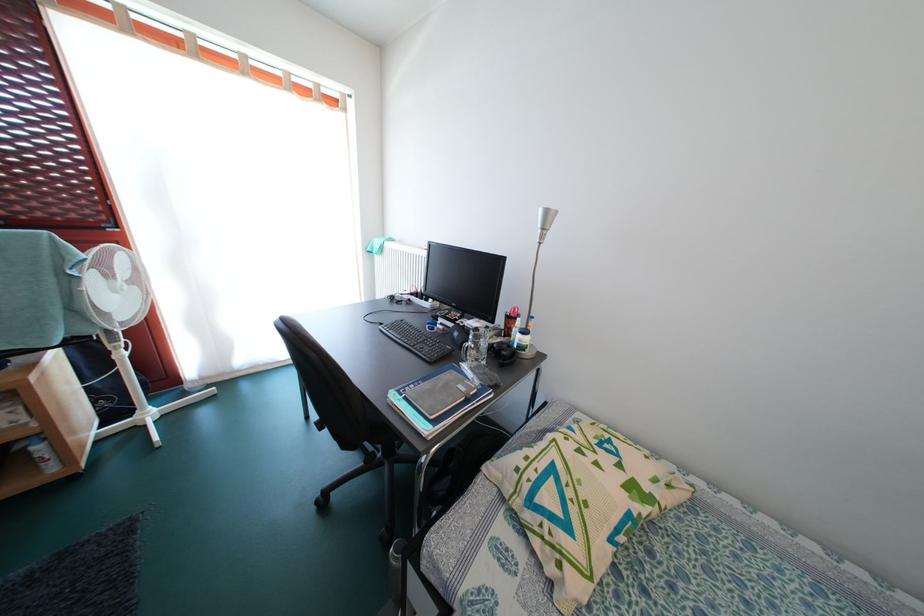
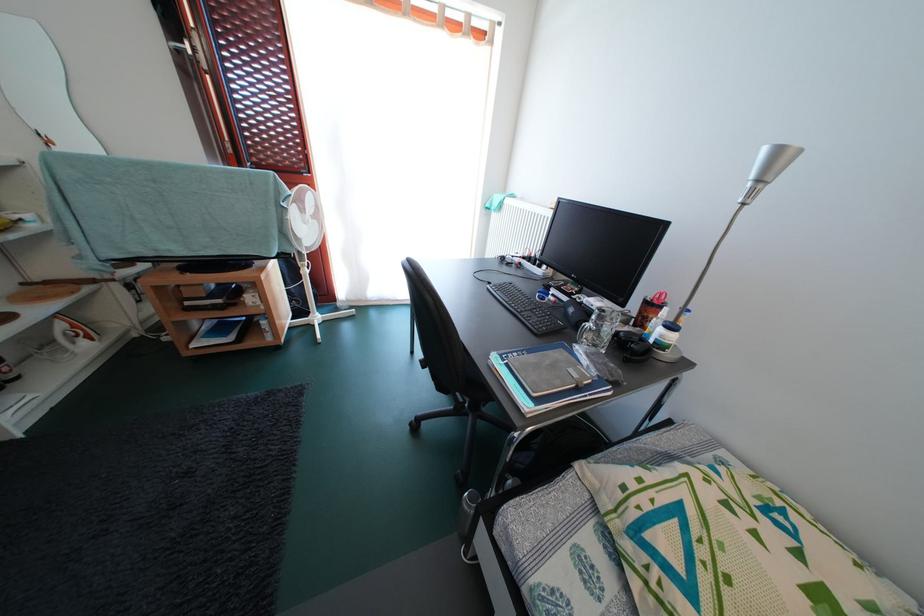
Find the pixel in the second image that matches point (391, 469) in the first image.

(475, 421)